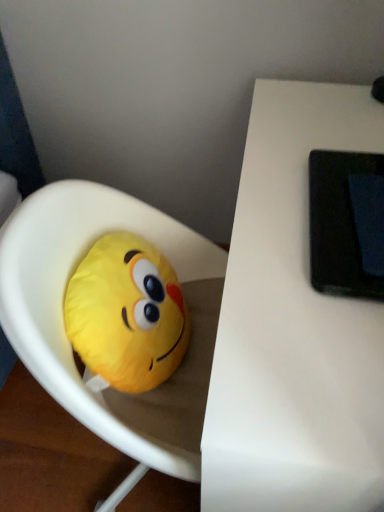
What do you see at coordinates (63, 324) in the screenshot?
I see `yellow fabric emoji pillow at left, arranged as the first toy when viewed from the right` at bounding box center [63, 324].

Measure the distance between yellow fabric emoji pillow at left, arranged as the first toy when viewed from the right, and camera.

The distance of yellow fabric emoji pillow at left, arranged as the first toy when viewed from the right, from camera is 22.91 inches.

Locate an element on the screen. This screenshot has height=512, width=384. white matte table at upper right is located at coordinates (293, 327).

Consider the image. Which is more to the left, white matte table at upper right or yellow fabric emoji pillow at left, arranged as the first toy when viewed from the right?

yellow fabric emoji pillow at left, arranged as the first toy when viewed from the right, is more to the left.

Which is in front, point (242, 338) or point (25, 298)?

The point (242, 338) is in front.

In the scene shown: Is white matte table at upper right oriented away from yellow fabric emoji pillow at left, arranged as the first toy when viewed from the right?

Yes, white matte table at upper right's orientation is away from yellow fabric emoji pillow at left, arranged as the first toy when viewed from the right.

Can yellow fabric emoji pillow at left, arranged as the first toy when viewed from the right, be found inside white matte table at upper right?

Indeed, yellow fabric emoji pillow at left, arranged as the first toy when viewed from the right, is located within white matte table at upper right.

Does yellow fabric emoji pillow at left, marked as the 2th toy in a left-to-right arrangement, appear on the left side of black matte tablet at upper right?

Yes, yellow fabric emoji pillow at left, marked as the 2th toy in a left-to-right arrangement, is to the left of black matte tablet at upper right.

From the image's perspective, is yellow fabric emoji pillow at left, marked as the 2th toy in a left-to-right arrangement, positioned above or below black matte tablet at upper right?

yellow fabric emoji pillow at left, marked as the 2th toy in a left-to-right arrangement, is situated lower than black matte tablet at upper right in the image.

Is yellow fabric emoji pillow at left, arranged as the first toy when viewed from the right, oriented away from black matte tablet at upper right?

No, black matte tablet at upper right is not at the back of yellow fabric emoji pillow at left, arranged as the first toy when viewed from the right.

Between yellow fabric emoji pillow at left, marked as the 2th toy in a left-to-right arrangement, and black matte tablet at upper right, which one has smaller size?

With smaller size is black matte tablet at upper right.

Considering the sizes of objects white matte table at upper right and yellow plush toy at left, placed as the 1th toy when sorted from left to right, in the image provided, who is smaller, white matte table at upper right or yellow plush toy at left, placed as the 1th toy when sorted from left to right,?

yellow plush toy at left, placed as the 1th toy when sorted from left to right, is smaller.

Which point is more forward, (275, 267) or (123, 304)?

The point (275, 267) is closer.

From the image's perspective, between white matte table at upper right and yellow plush toy at left, the 2th toy from the right, who is located below?

white matte table at upper right.

Is point (318, 151) closer to camera compared to point (358, 423)?

No.

What's the angular difference between black matte tablet at upper right and white matte table at upper right's facing directions?

The angular difference between black matte tablet at upper right and white matte table at upper right is 0.149 degrees.

Which object is closer to the camera taking this photo, black matte tablet at upper right or white matte table at upper right?

white matte table at upper right is closer to the camera.

Is black matte tablet at upper right situated inside white matte table at upper right or outside?

black matte tablet at upper right is spatially situated outside white matte table at upper right.

From the image's perspective, between black matte tablet at upper right and yellow plush toy at left, placed as the 1th toy when sorted from left to right, who is located below?

yellow plush toy at left, placed as the 1th toy when sorted from left to right, from the image's perspective.

From a real-world perspective, between black matte tablet at upper right and yellow plush toy at left, placed as the 1th toy when sorted from left to right, who is vertically higher?

black matte tablet at upper right, from a real-world perspective.

How many degrees apart are the facing directions of black matte tablet at upper right and yellow plush toy at left, the 2th toy from the right?

There is a 180-degree angle between the facing directions of black matte tablet at upper right and yellow plush toy at left, the 2th toy from the right.

From the image's perspective, is black matte tablet at upper right on yellow fabric emoji pillow at left, arranged as the first toy when viewed from the right?

Indeed, from the image's perspective, black matte tablet at upper right is shown above yellow fabric emoji pillow at left, arranged as the first toy when viewed from the right.

How many degrees apart are the facing directions of black matte tablet at upper right and yellow fabric emoji pillow at left, marked as the 2th toy in a left-to-right arrangement?

They differ by 178 degrees in their facing directions.

Is black matte tablet at upper right thinner than yellow fabric emoji pillow at left, marked as the 2th toy in a left-to-right arrangement?

Indeed, black matte tablet at upper right has a lesser width compared to yellow fabric emoji pillow at left, marked as the 2th toy in a left-to-right arrangement.

Relative to black matte tablet at upper right, is yellow plush toy at left, placed as the 1th toy when sorted from left to right, in front or behind?

Clearly, yellow plush toy at left, placed as the 1th toy when sorted from left to right, is behind black matte tablet at upper right.

How different are the orientations of yellow plush toy at left, placed as the 1th toy when sorted from left to right, and black matte tablet at upper right in degrees?

The facing directions of yellow plush toy at left, placed as the 1th toy when sorted from left to right, and black matte tablet at upper right are 180 degrees apart.

Who is smaller, yellow plush toy at left, the 2th toy from the right, or black matte tablet at upper right?

black matte tablet at upper right.

From the image's perspective, is yellow plush toy at left, placed as the 1th toy when sorted from left to right, above black matte tablet at upper right?

No, from the image's perspective, yellow plush toy at left, placed as the 1th toy when sorted from left to right, is not on top of black matte tablet at upper right.

Which toy is the 1st one when counting from the left side of the white matte table at upper right? Please provide its 2D coordinates.

[(63, 324)]

In order to click on toy that is the 2nd one when counting downward from the black matte tablet at upper right (from the image's perspective) in this screenshot , I will do `click(63, 324)`.

Which object lies nearer to the anchor point yellow fabric emoji pillow at left, arranged as the first toy when viewed from the right, black matte tablet at upper right or white matte table at upper right?

The object closer to yellow fabric emoji pillow at left, arranged as the first toy when viewed from the right, is white matte table at upper right.

Considering their positions, is white matte table at upper right positioned closer to yellow plush toy at left, placed as the 1th toy when sorted from left to right, than yellow fabric emoji pillow at left, marked as the 2th toy in a left-to-right arrangement?

yellow fabric emoji pillow at left, marked as the 2th toy in a left-to-right arrangement, is closer to yellow plush toy at left, placed as the 1th toy when sorted from left to right.

Looking at the image, which one is located closer to black matte tablet at upper right, yellow fabric emoji pillow at left, marked as the 2th toy in a left-to-right arrangement, or yellow plush toy at left, placed as the 1th toy when sorted from left to right?

The object closer to black matte tablet at upper right is yellow plush toy at left, placed as the 1th toy when sorted from left to right.

Based on their spatial positions, is yellow fabric emoji pillow at left, marked as the 2th toy in a left-to-right arrangement, or white matte table at upper right closer to black matte tablet at upper right?

Based on the image, white matte table at upper right appears to be nearer to black matte tablet at upper right.

Based on their spatial positions, is white matte table at upper right or black matte tablet at upper right further from yellow plush toy at left, the 2th toy from the right?

Among the two, black matte tablet at upper right is located further to yellow plush toy at left, the 2th toy from the right.

From the image, which object appears to be nearer to yellow fabric emoji pillow at left, marked as the 2th toy in a left-to-right arrangement, black matte tablet at upper right or yellow plush toy at left, the 2th toy from the right?

The object closer to yellow fabric emoji pillow at left, marked as the 2th toy in a left-to-right arrangement, is yellow plush toy at left, the 2th toy from the right.

Based on their spatial positions, is yellow fabric emoji pillow at left, marked as the 2th toy in a left-to-right arrangement, or yellow plush toy at left, placed as the 1th toy when sorted from left to right, further from white matte table at upper right?

yellow plush toy at left, placed as the 1th toy when sorted from left to right, lies further to white matte table at upper right than the other object.

From the image, which object appears to be nearer to white matte table at upper right, yellow plush toy at left, the 2th toy from the right, or black matte tablet at upper right?

Based on the image, black matte tablet at upper right appears to be nearer to white matte table at upper right.

I want to click on table between yellow plush toy at left, the 2th toy from the right, and black matte tablet at upper right, in the horizontal direction, so click(x=293, y=327).

Identify the location of table located between yellow fabric emoji pillow at left, arranged as the first toy when viewed from the right, and black matte tablet at upper right in the left-right direction. This screenshot has height=512, width=384. (293, 327).

The image size is (384, 512). What are the coordinates of `toy between yellow plush toy at left, placed as the 1th toy when sorted from left to right, and black matte tablet at upper right, in the horizontal direction` in the screenshot? It's located at (63, 324).

At what (x,y) coordinates should I click in order to perform the action: click on toy located between yellow plush toy at left, the 2th toy from the right, and white matte table at upper right in the left-right direction. Please return your answer as a coordinate pair (x, y). Looking at the image, I should click on (63, 324).